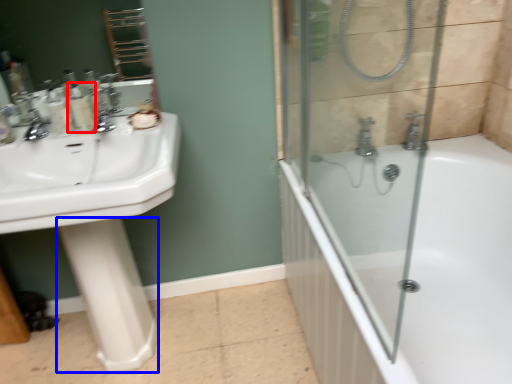
Question: Which object appears farthest to the camera in this image, toiletry (highlighted by a red box) or bidet (highlighted by a blue box)?

Choices:
 (A) toiletry
 (B) bidet

Answer: (A)